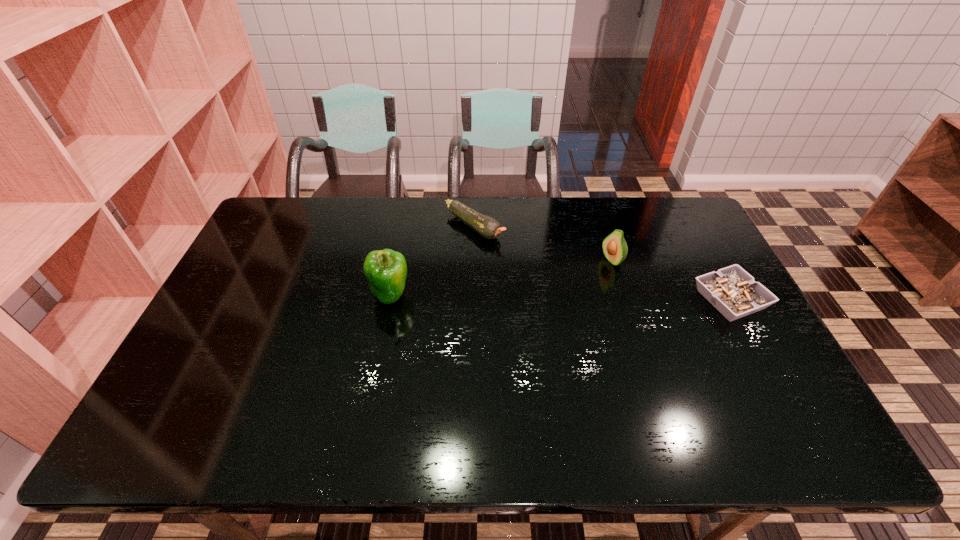
Find the location of a particular element. The width and height of the screenshot is (960, 540). vacant region located on the cut side of the second farthest object is located at coordinates (549, 289).

Locate an element on the screen. The width and height of the screenshot is (960, 540). free space located on the cut side of the second farthest object is located at coordinates (494, 313).

The image size is (960, 540). I want to click on free region located on the cut side of the second farthest object, so 521,301.

Identify the location of vacant space located 0.320m at the blossom end of the farthest object. Image resolution: width=960 pixels, height=540 pixels. (568, 292).

Where is `free space located at the blossom end of the farthest object`? The height and width of the screenshot is (540, 960). free space located at the blossom end of the farthest object is located at coordinates (532, 266).

Identify the location of free region located 0.050m at the blossom end of the farthest object. (505, 247).

Locate an element on the screen. The width and height of the screenshot is (960, 540). object that is at the far edge is located at coordinates (489, 228).

You are a GUI agent. You are given a task and a screenshot of the screen. Output one action in this format:
    pyautogui.click(x=<x>, y=<y>)
    Task: Click on the object located in the right edge section of the desktop
    The width and height of the screenshot is (960, 540).
    Given the screenshot: What is the action you would take?
    pyautogui.click(x=731, y=290)

At what (x,y) coordinates should I click in order to perform the action: click on vacant space at the far edge of the desktop. Please return your answer as a coordinate pair (x, y). Looking at the image, I should click on (621, 198).

The height and width of the screenshot is (540, 960). Find the location of `vacant area at the near edge`. vacant area at the near edge is located at coordinates (395, 381).